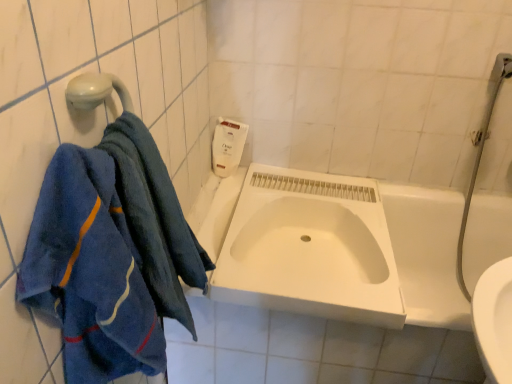
Question: Is the position of white plastic soap dispenser at upper center less distant than that of blue terry cloth towel at left, positioned as the 2th towel in back-to-front order?

Choices:
 (A) no
 (B) yes

Answer: (A)

Question: Is white plastic soap dispenser at upper center with blue terry cloth towel at left, marked as the first towel in a front-to-back arrangement?

Choices:
 (A) no
 (B) yes

Answer: (A)

Question: Does white plastic soap dispenser at upper center have a smaller size compared to blue terry cloth towel at left, positioned as the 2th towel in back-to-front order?

Choices:
 (A) yes
 (B) no

Answer: (A)

Question: From a real-world perspective, is white plastic soap dispenser at upper center over blue terry cloth towel at left, positioned as the 2th towel in back-to-front order?

Choices:
 (A) no
 (B) yes

Answer: (A)

Question: Can blue terry cloth towel at left, marked as the first towel in a front-to-back arrangement, be found inside white plastic soap dispenser at upper center?

Choices:
 (A) yes
 (B) no

Answer: (B)

Question: Is white plastic soap dispenser at upper center aimed at blue terry cloth towel at left, marked as the first towel in a front-to-back arrangement?

Choices:
 (A) no
 (B) yes

Answer: (B)

Question: Considering the relative positions of blue terry cloth towel at left, which is the second towel in front-to-back order, and white matte sink at center in the image provided, is blue terry cloth towel at left, which is the second towel in front-to-back order, behind white matte sink at center?

Choices:
 (A) yes
 (B) no

Answer: (B)

Question: From the image's perspective, is blue terry cloth towel at left, positioned as the 1th towel in back-to-front order, under white matte sink at center?

Choices:
 (A) no
 (B) yes

Answer: (B)

Question: Is blue terry cloth towel at left, which is the second towel in front-to-back order, to the left of white matte sink at center from the viewer's perspective?

Choices:
 (A) yes
 (B) no

Answer: (A)

Question: Is blue terry cloth towel at left, which is the second towel in front-to-back order, smaller than white matte sink at center?

Choices:
 (A) yes
 (B) no

Answer: (A)

Question: From the image's perspective, would you say blue terry cloth towel at left, which is the second towel in front-to-back order, is positioned over white matte sink at center?

Choices:
 (A) yes
 (B) no

Answer: (B)

Question: Can we say blue terry cloth towel at left, which is the second towel in front-to-back order, lies outside white matte sink at center?

Choices:
 (A) no
 (B) yes

Answer: (B)

Question: From a real-world perspective, is white plastic soap dispenser at upper center located higher than white matte sink at center?

Choices:
 (A) no
 (B) yes

Answer: (B)